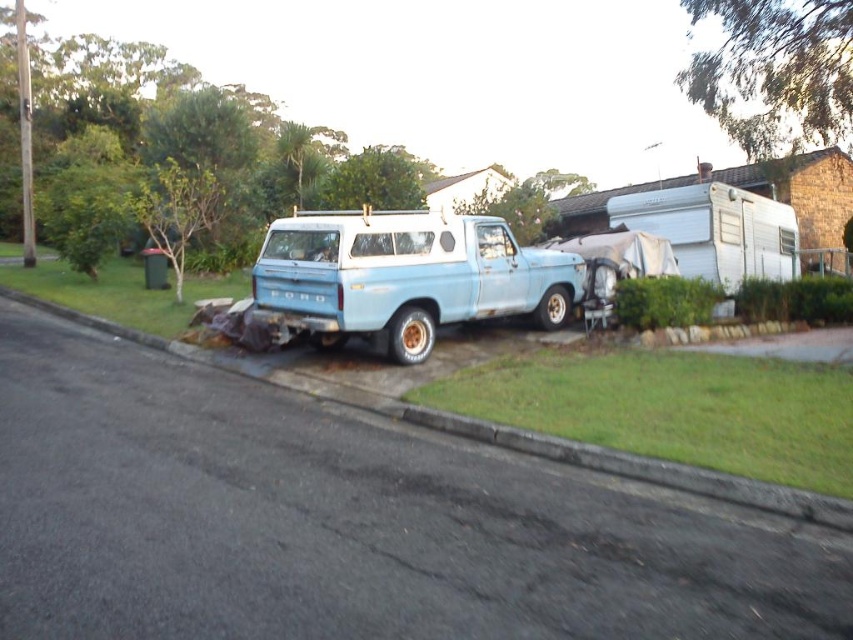
Question: Which of the following is the closest to the observer?

Choices:
 (A) (355, 387)
 (B) (670, 237)
 (C) (318, 220)

Answer: (A)

Question: Is light blue matte truck at center further to the viewer compared to asphalt at lower center?

Choices:
 (A) yes
 (B) no

Answer: (A)

Question: Which point is closer to the camera?

Choices:
 (A) (798, 518)
 (B) (669, 198)
 (C) (563, 310)

Answer: (A)

Question: Can you confirm if asphalt at lower center is bigger than white matte camper at upper right?

Choices:
 (A) yes
 (B) no

Answer: (A)

Question: Estimate the real-world distances between objects in this image. Which object is farther from the asphalt at lower center?

Choices:
 (A) white matte camper at upper right
 (B) light blue matte truck at center

Answer: (A)

Question: Is light blue matte truck at center thinner than asphalt at lower center?

Choices:
 (A) no
 (B) yes

Answer: (B)